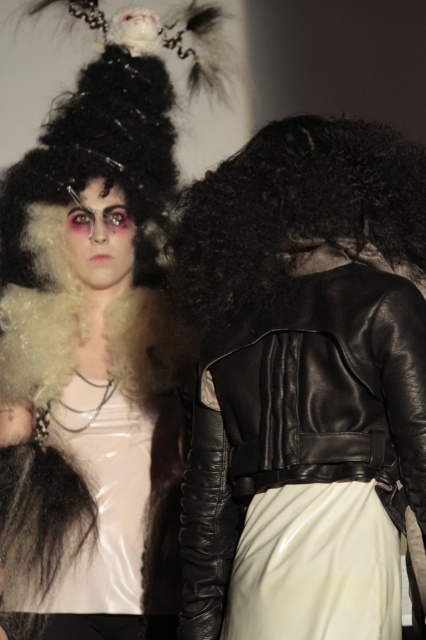
Is black curly wig at back below white glossy dress at center?

Incorrect, black curly wig at back is not positioned below white glossy dress at center.

Which is behind, point (356, 145) or point (115, 401)?

The point (115, 401) is behind.

This screenshot has height=640, width=426. Describe the element at coordinates (296, 212) in the screenshot. I see `black curly wig at back` at that location.

The height and width of the screenshot is (640, 426). I want to click on black curly wig at back, so click(296, 212).